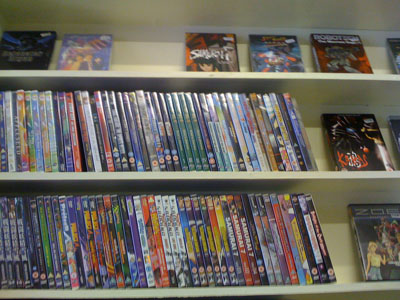
At what (x,y) coordinates should I click in order to perform the action: click on dvds on the top shelf. Please return your answer as a coordinate pair (x, y). This screenshot has width=400, height=300. Looking at the image, I should click on (30, 61), (78, 59), (204, 55), (280, 51), (333, 57), (397, 55).